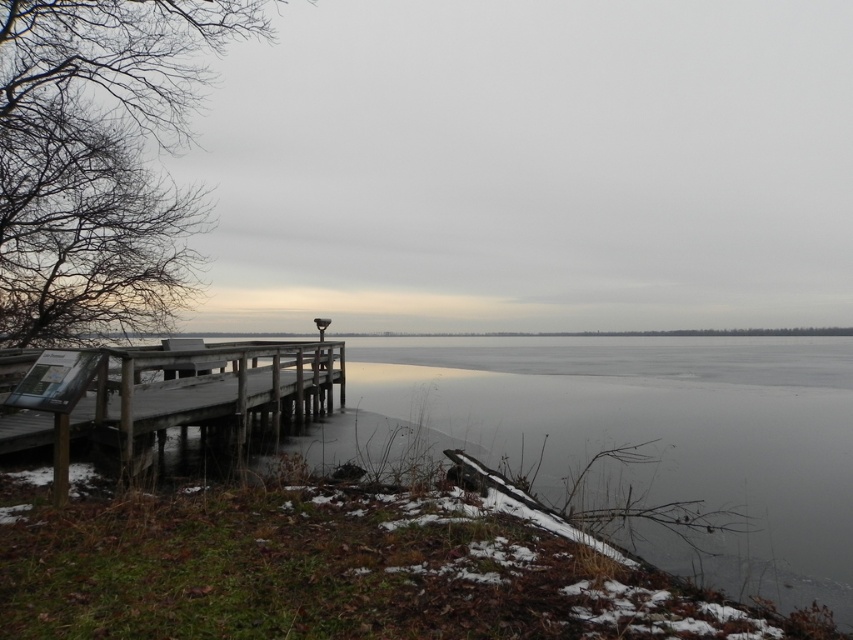
Which is more to the left, transparent ice at lower center or wooden dock at lower left?

wooden dock at lower left

Is point (643, 432) behind point (68, 388)?

Yes, it is behind point (68, 388).

This screenshot has width=853, height=640. What do you see at coordinates (646, 429) in the screenshot?
I see `transparent ice at lower center` at bounding box center [646, 429].

The width and height of the screenshot is (853, 640). In order to click on transparent ice at lower center in this screenshot , I will do click(646, 429).